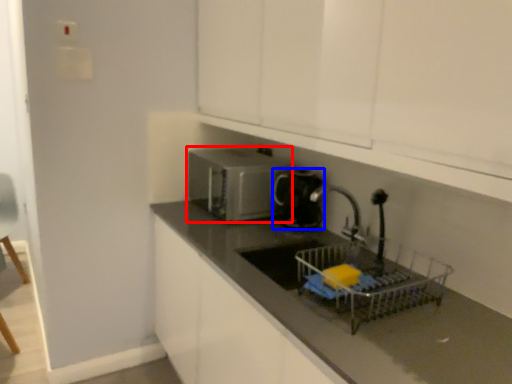
Question: Among these objects, which one is farthest to the camera, home appliance (highlighted by a red box) or kitchen appliance (highlighted by a blue box)?

Choices:
 (A) home appliance
 (B) kitchen appliance

Answer: (A)